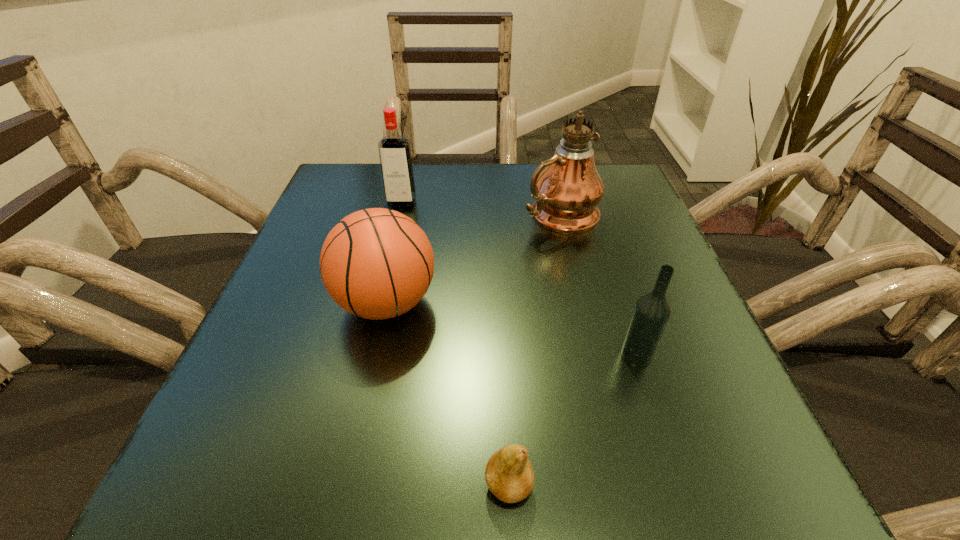
Image resolution: width=960 pixels, height=540 pixels. Find the location of `vacant area between the shorter vodka and the basketball`. vacant area between the shorter vodka and the basketball is located at coordinates (512, 329).

Where is `free space between the nearer vodka and the basketball`? The image size is (960, 540). free space between the nearer vodka and the basketball is located at coordinates (512, 329).

Find the location of a particular element. free space between the oil lamp and the nearest object is located at coordinates (535, 350).

The image size is (960, 540). In order to click on free space between the oil lamp and the farther vodka in this screenshot , I will do `click(481, 208)`.

What are the coordinates of `free space between the basketball and the nearer vodka` in the screenshot? It's located at (512, 329).

Locate which object ranks fourth in proximity to the farther vodka. Please provide its 2D coordinates. Your answer should be formatted as a tuple, i.e. [(x, y)], where the tuple contains the x and y coordinates of a point satisfying the conditions above.

[(509, 475)]

Where is `object that is the third closest to the shorter vodka`? object that is the third closest to the shorter vodka is located at coordinates (376, 263).

This screenshot has width=960, height=540. What are the coordinates of `free location that satisfies the following two spatial constraints: 1. on the front and back of the taller vodka; 2. on the left side of the nearer vodka` in the screenshot? It's located at (365, 355).

Image resolution: width=960 pixels, height=540 pixels. Find the location of `vacant space that satisfies the following two spatial constraints: 1. on the front and back of the nearer vodka; 2. on the right side of the taller vodka`. vacant space that satisfies the following two spatial constraints: 1. on the front and back of the nearer vodka; 2. on the right side of the taller vodka is located at coordinates (365, 355).

Identify the location of vacant space that satisfies the following two spatial constraints: 1. on the front side of the basketball; 2. on the right side of the third object from left to right. (346, 485).